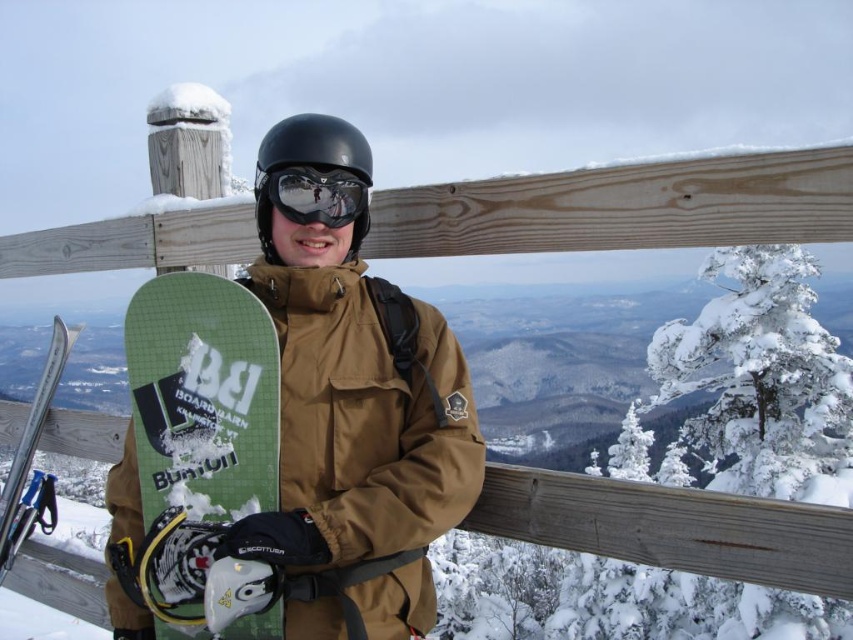
You are a photographer trying to capture the green matte snowboard at lower left and the black matte helmet at center in a single frame. Based on their positions, which object should you adjust your camera angle to focus on first if you want to include both in the shot?

The green matte snowboard at lower left is to the left of the black matte helmet at center, so you should focus on the green matte snowboard at lower left first to ensure both are in the frame.

You are a winter sports instructor holding a measuring tape. You want to ensure that the distance between the matte brown snowboard at center and the glossy reflective goggles at center is safe for a beginner. The recommended minimum safe distance is 12 inches. Is the current distance sufficient?

The distance between the matte brown snowboard at center and the glossy reflective goggles at center is 12.10 inches, which is just above the recommended minimum safe distance of 12 inches. Therefore, the current distance is sufficient.

You are a delivery robot that needs to place a package between the green matte snowboard at lower left and the black matte helmet at center. The package is 20 inches long. Can you fit it between them?

The distance between the green matte snowboard at lower left and the black matte helmet at center is 22.12 inches, so yes, the package can fit as it is shorter than the available space.